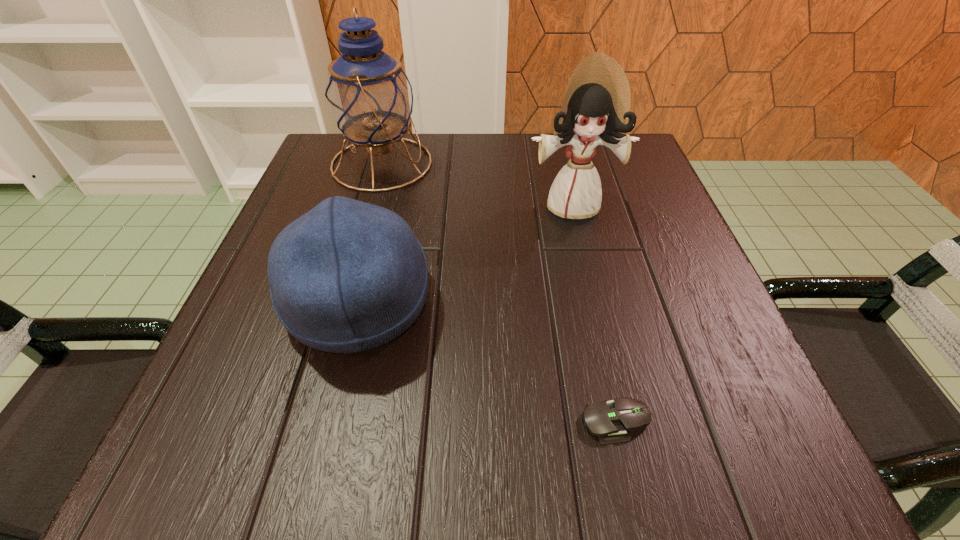
This screenshot has height=540, width=960. In order to click on lantern in this screenshot , I will do `click(369, 97)`.

Find the location of `doll`. doll is located at coordinates (596, 106).

Where is `skullcap`? The image size is (960, 540). skullcap is located at coordinates (347, 276).

Locate an element on the screen. The image size is (960, 540). the second nearest object is located at coordinates (347, 276).

Find the location of a particular element. The image size is (960, 540). the shortest object is located at coordinates (610, 420).

In order to click on the nearest object in this screenshot , I will do `click(610, 420)`.

Locate an element on the screen. The image size is (960, 540). free spot located 0.360m on the front-facing side of the lantern is located at coordinates (593, 164).

The height and width of the screenshot is (540, 960). Identify the location of free space located at the front face of the doll. (621, 410).

The height and width of the screenshot is (540, 960). In order to click on vacant space positioned 0.360m on the right of the skullcap in this screenshot , I will do `click(657, 302)`.

Image resolution: width=960 pixels, height=540 pixels. What are the coordinates of `blank space located 0.240m on the back of the computer mouse` in the screenshot? It's located at (582, 271).